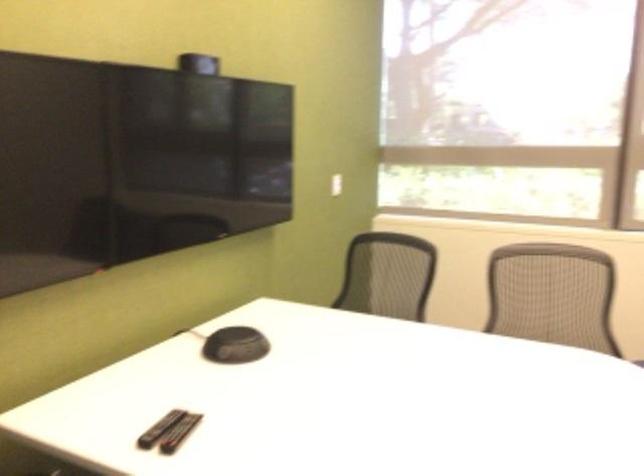
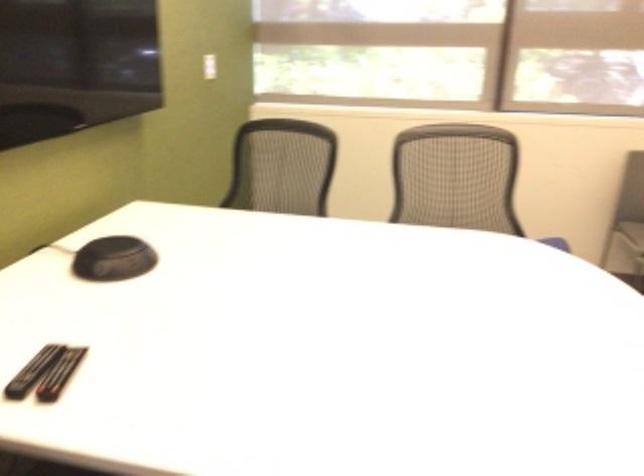
Find the pixel in the second image that matches pixel 337 183 in the first image.

(209, 66)